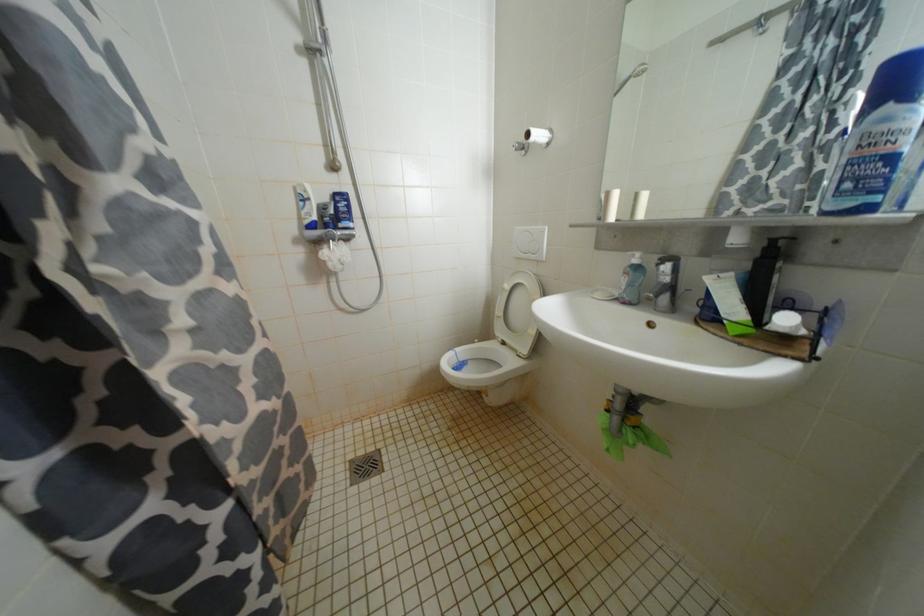
What do you see at coordinates (343, 214) in the screenshot? The width and height of the screenshot is (924, 616). I see `the blue plastic bottle` at bounding box center [343, 214].